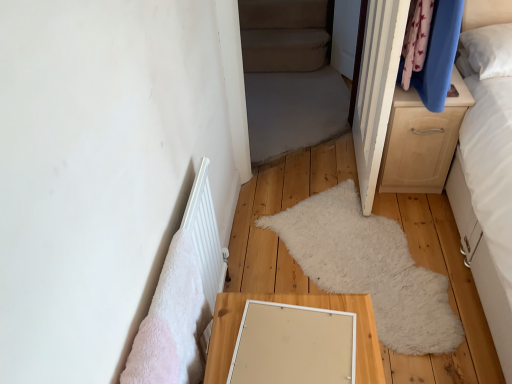
This screenshot has height=384, width=512. What are the coordinates of `vacant space to the left of white wood door at upper right` in the screenshot? It's located at (296, 177).